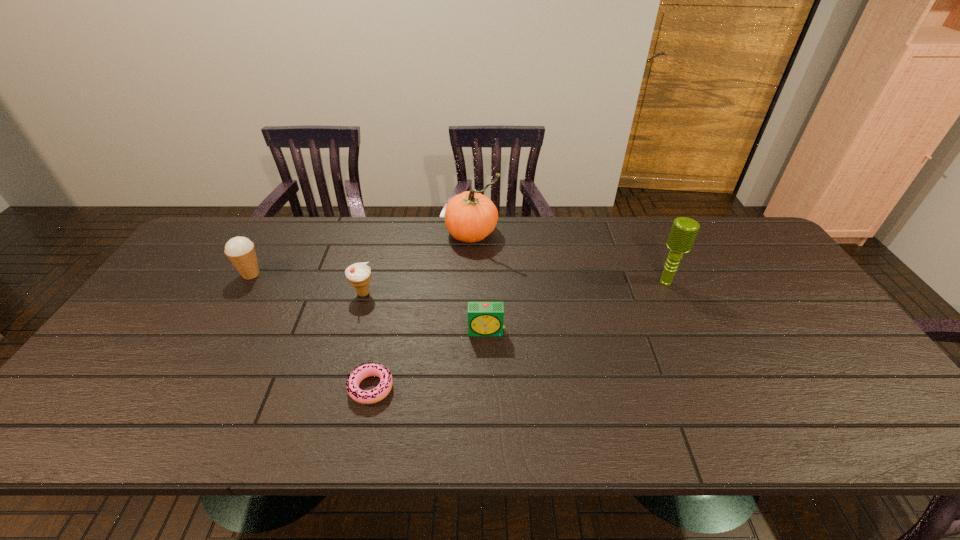
Where is `the nearest object`? This screenshot has width=960, height=540. the nearest object is located at coordinates (365, 370).

Find the location of a particular element. The height and width of the screenshot is (540, 960). vacant space located 0.330m on the left of the pumpkin is located at coordinates (348, 233).

Identify the location of free space located on the back of the microphone. (647, 240).

At what (x,y) coordinates should I click in order to perform the action: click on vacant space situated on the front of the farther icecream. Please return your answer as a coordinate pair (x, y). Looking at the image, I should click on (192, 376).

I want to click on free region located on the right of the nearer icecream, so click(x=403, y=293).

Image resolution: width=960 pixels, height=540 pixels. In order to click on vacant space positioned 0.290m on the front-facing side of the second shortest object in this screenshot , I will do `click(488, 443)`.

I want to click on free region located 0.320m on the right of the doughnut, so click(530, 388).

Find the location of `object that is positioned at the far edge`. object that is positioned at the far edge is located at coordinates (470, 217).

Locate an element on the screen. The image size is (960, 540). object located at the near edge is located at coordinates (365, 370).

Identify the location of vacant space at the far edge of the desktop. The width and height of the screenshot is (960, 540). (324, 241).